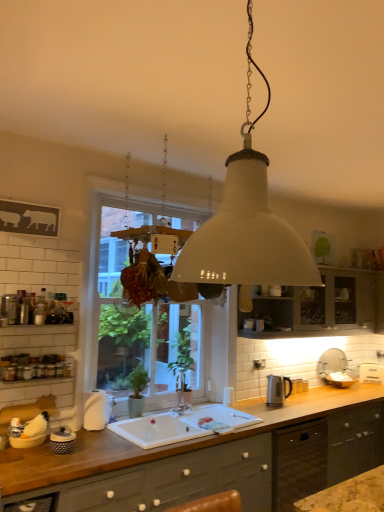
In order to click on free location in front of polished stainless steel kettle at right, placed as the 2th appliance when sorted from left to right in this screenshot , I will do `click(292, 408)`.